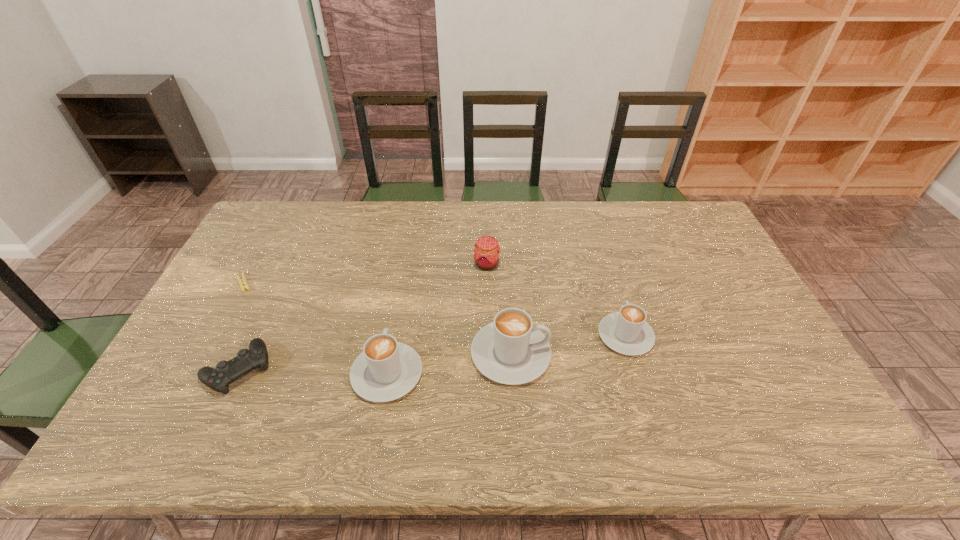
The image size is (960, 540). What are the coordinates of `free location located 0.160m to the right of the fifth shortest object` in the screenshot? It's located at (400, 301).

Where is `free region located 0.260m to the right of the second cappuccino from left to right`? The width and height of the screenshot is (960, 540). free region located 0.260m to the right of the second cappuccino from left to right is located at coordinates (649, 354).

Find the location of a particular element. vacant space located to the right of the shortest cappuccino is located at coordinates (606, 270).

This screenshot has width=960, height=540. In order to click on blank area located to the right of the shortest cappuccino in this screenshot , I will do `click(598, 244)`.

Find the location of a particular element. The width and height of the screenshot is (960, 540). vacant space located to the right of the shortest cappuccino is located at coordinates (601, 253).

The height and width of the screenshot is (540, 960). I want to click on vacant space located on the left of the jam, so click(x=355, y=264).

Where is `vacant position located on the back of the clothespin`? The height and width of the screenshot is (540, 960). vacant position located on the back of the clothespin is located at coordinates (260, 252).

Find the location of a particular element. free space located 0.360m on the right of the control is located at coordinates (412, 369).

Find the location of a particular element. control situated at the near edge is located at coordinates (246, 361).

The image size is (960, 540). Find the location of `clothespin at the left edge`. clothespin at the left edge is located at coordinates (243, 285).